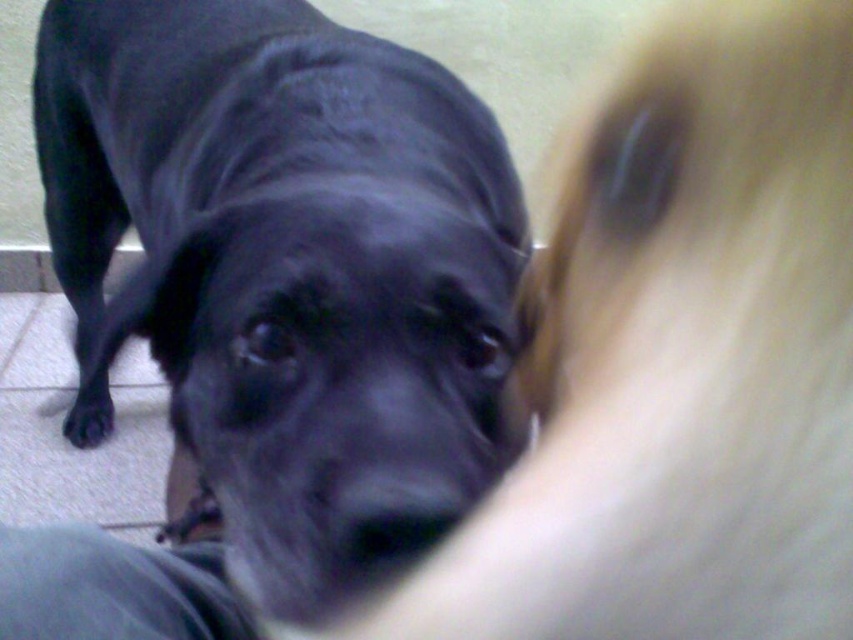
You are a dog owner trying to clean your home. You see the gray fabric at lower left and the black matte paw at lower left. Which object is covering the other one?

The gray fabric at lower left is positioned over the black matte paw at lower left, so the gray fabric is covering the black matte paw.

You are holding a 12 inch ruler and want to measure the distance between the gray fabric at lower left and the camera. Can your ruler reach that distance?

The distance between the gray fabric at lower left and the camera is 13.31 inches, so the 12 inch ruler is too short to measure the distance. You need a longer ruler.

In the scene shown: You are a photographer setting up a shoot. You have a black smooth dog at center and a gray fabric at lower left. Which object should you focus on to ensure the subject is sharp, considering their sizes?

The black smooth dog at center is bigger than the gray fabric at lower left, so you should focus on the black smooth dog at center to ensure the subject is sharp.